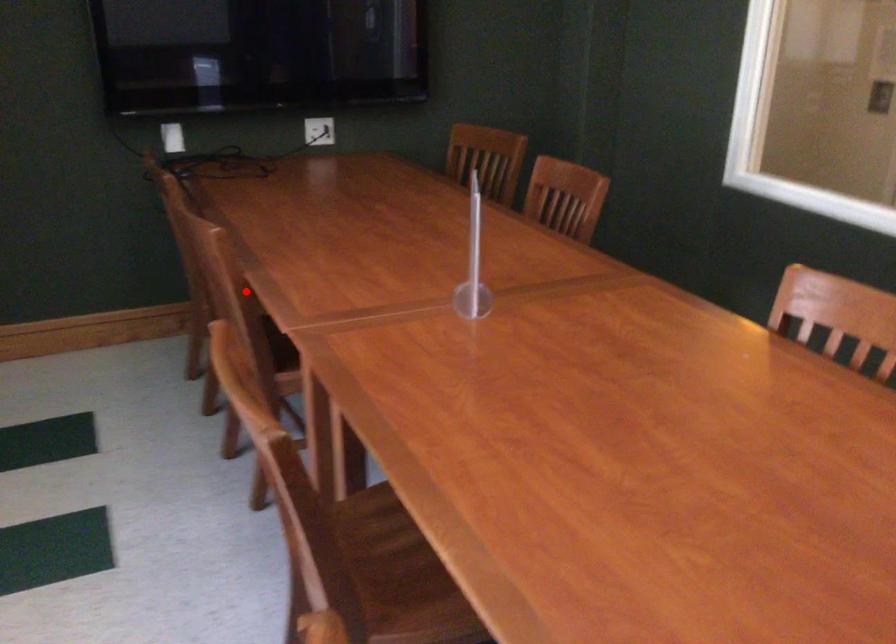
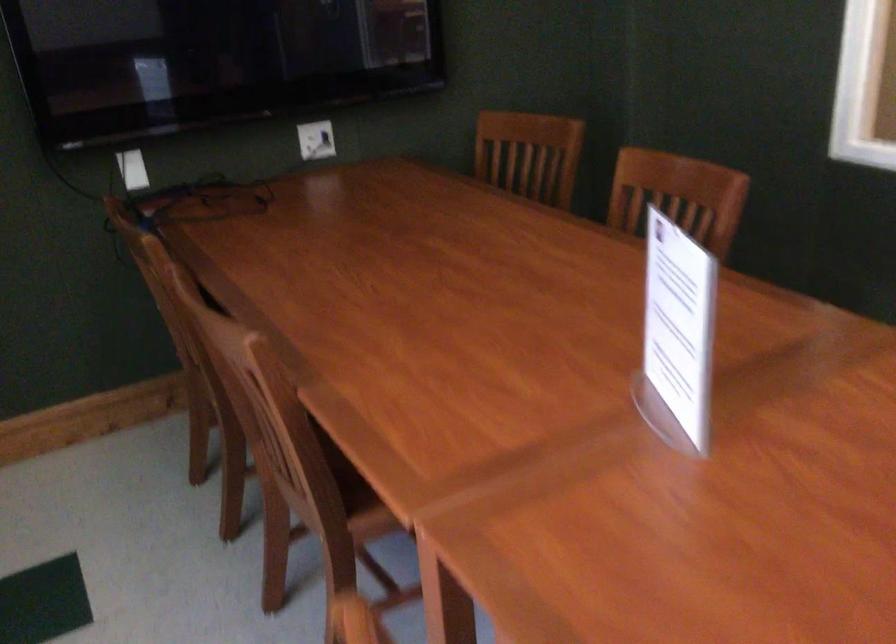
In the second image, find the point that corresponds to the highlighted location in the first image.

(299, 413)